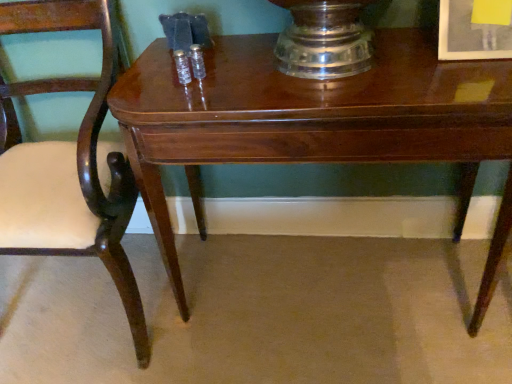
Question: From a real-world perspective, relative to matte white picture frame at upper right, is glossy wood table at center vertically above or below?

Choices:
 (A) below
 (B) above

Answer: (A)

Question: Is glossy wood table at center wider or thinner than matte white picture frame at upper right?

Choices:
 (A) thin
 (B) wide

Answer: (B)

Question: Which object is the closest to the mahogany wood chair at left?

Choices:
 (A) matte white picture frame at upper right
 (B) glossy wood table at center

Answer: (B)

Question: Which is farther from the mahogany wood chair at left?

Choices:
 (A) glossy wood table at center
 (B) matte white picture frame at upper right

Answer: (B)